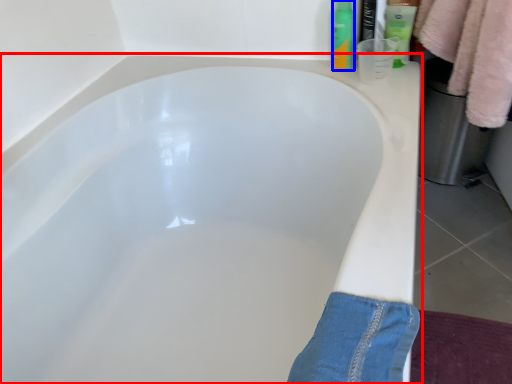
Question: Among these objects, which one is farthest to the camera, bathtub (highlighted by a red box) or toiletry (highlighted by a blue box)?

Choices:
 (A) bathtub
 (B) toiletry

Answer: (B)